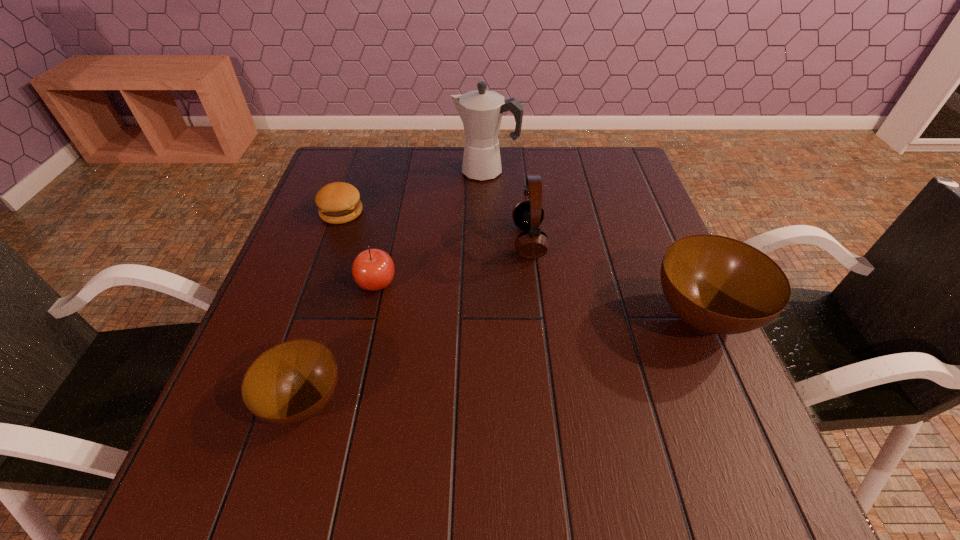
If we want them evenly spaced by inserting an extra bowl among them, please locate a free spot for this new bowl. Please provide its 2D coordinates. Your answer should be formatted as a tuple, i.e. [(x, y)], where the tuple contains the x and y coordinates of a point satisfying the conditions above.

[(518, 355)]